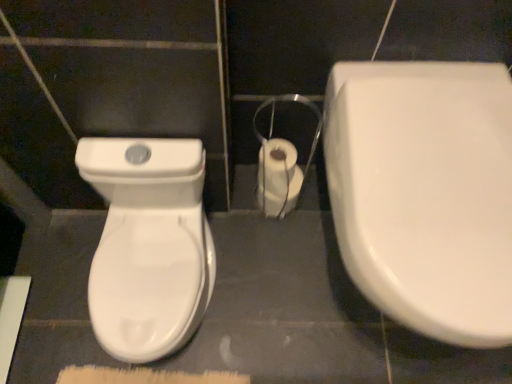
Question: Are white glossy toilet at left, which ranks as the 1th toilet in left-to-right order, and white glossy toilet at right, the first toilet positioned from the right, making contact?

Choices:
 (A) yes
 (B) no

Answer: (B)

Question: From the image's perspective, is white glossy toilet at left, which is counted as the 2th toilet, starting from the right, below white glossy toilet at right, which appears as the 2th toilet when viewed from the left?

Choices:
 (A) yes
 (B) no

Answer: (A)

Question: Is white glossy toilet at left, which is counted as the 2th toilet, starting from the right, outside white glossy toilet at right, the first toilet positioned from the right?

Choices:
 (A) no
 (B) yes

Answer: (B)

Question: Considering the relative positions of white glossy toilet at left, which ranks as the 1th toilet in left-to-right order, and white glossy toilet at right, the first toilet positioned from the right, in the image provided, is white glossy toilet at left, which ranks as the 1th toilet in left-to-right order, to the right of white glossy toilet at right, the first toilet positioned from the right, from the viewer's perspective?

Choices:
 (A) no
 (B) yes

Answer: (A)

Question: Does white glossy toilet at left, which ranks as the 1th toilet in left-to-right order, have a smaller size compared to white glossy toilet at right, the first toilet positioned from the right?

Choices:
 (A) yes
 (B) no

Answer: (A)

Question: Considering the relative sizes of white glossy toilet at left, which is counted as the 2th toilet, starting from the right, and white glossy toilet at right, the first toilet positioned from the right, in the image provided, is white glossy toilet at left, which is counted as the 2th toilet, starting from the right, thinner than white glossy toilet at right, the first toilet positioned from the right,?

Choices:
 (A) no
 (B) yes

Answer: (B)

Question: From the image's perspective, is white glossy toilet at right, the first toilet positioned from the right, beneath white glossy toilet paper at center?

Choices:
 (A) no
 (B) yes

Answer: (B)

Question: Is white glossy toilet at right, the first toilet positioned from the right, located outside white glossy toilet paper at center?

Choices:
 (A) yes
 (B) no

Answer: (A)

Question: Considering the relative sizes of white glossy toilet at right, the first toilet positioned from the right, and white glossy toilet paper at center in the image provided, is white glossy toilet at right, the first toilet positioned from the right, bigger than white glossy toilet paper at center?

Choices:
 (A) no
 (B) yes

Answer: (B)

Question: Can you confirm if white glossy toilet at right, the first toilet positioned from the right, is smaller than white glossy toilet paper at center?

Choices:
 (A) no
 (B) yes

Answer: (A)

Question: Is white glossy toilet at right, the first toilet positioned from the right, taller than white glossy toilet paper at center?

Choices:
 (A) no
 (B) yes

Answer: (B)

Question: Can you confirm if white glossy toilet at right, the first toilet positioned from the right, is thinner than white glossy toilet paper at center?

Choices:
 (A) yes
 (B) no

Answer: (B)

Question: Is white glossy toilet paper at center far away from white glossy toilet at left, which ranks as the 1th toilet in left-to-right order?

Choices:
 (A) no
 (B) yes

Answer: (A)